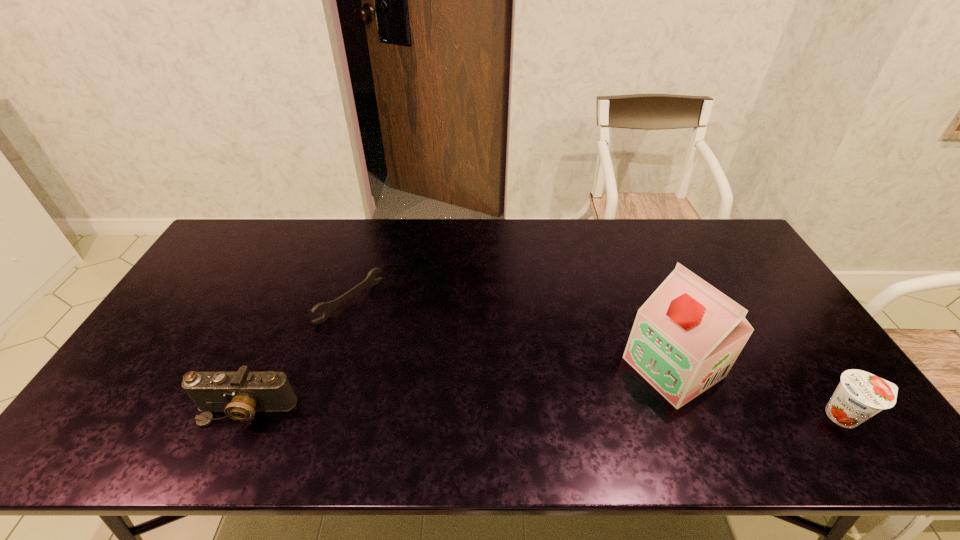
Image resolution: width=960 pixels, height=540 pixels. I want to click on free space on the desktop that is between the camera and the rightmost object and is positioned on the open ends of the wrench, so click(508, 413).

This screenshot has width=960, height=540. Find the location of `vacant space on the desktop that is between the camera and the rightmost object and is positioned with the cap open on the soya milk`. vacant space on the desktop that is between the camera and the rightmost object and is positioned with the cap open on the soya milk is located at coordinates (598, 413).